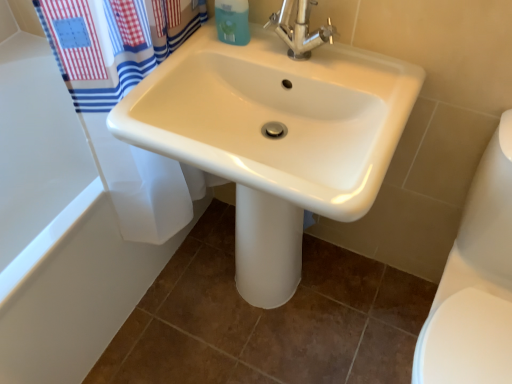
At what (x,y) coordinates should I click in order to perform the action: click on free space in front of blue matte soap dispenser at upper center. Please return your answer as a coordinate pair (x, y). This screenshot has width=512, height=384. Looking at the image, I should click on (221, 63).